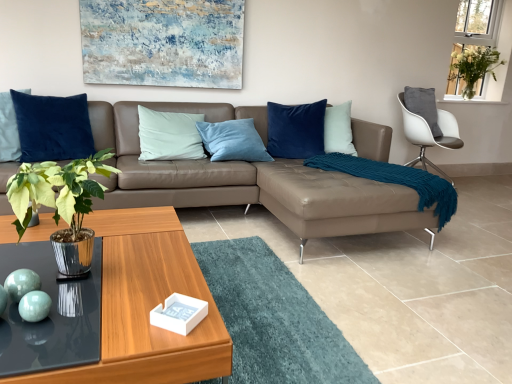
The height and width of the screenshot is (384, 512). What are the coordinates of `free spot to the right of teal glossy sphere at lower left, which appears as the first teal when viewed from the right` in the screenshot? It's located at (90, 320).